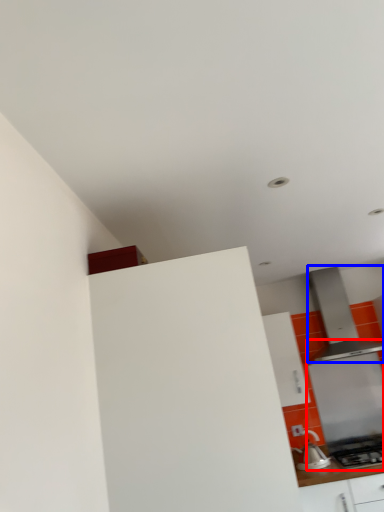
Question: Among these objects, which one is nearest to the camera, appliance (highlighted by a red box) or home appliance (highlighted by a blue box)?

Choices:
 (A) appliance
 (B) home appliance

Answer: (B)